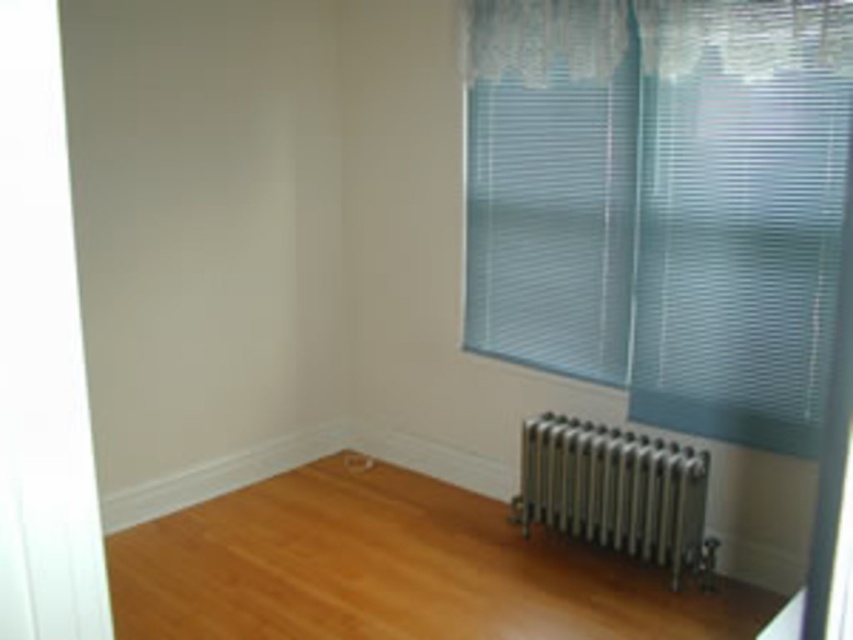
Question: Is translucent plastic blinds at right to the right of silver metallic radiator at lower right from the viewer's perspective?

Choices:
 (A) yes
 (B) no

Answer: (A)

Question: Among these points, which one is nearest to the camera?

Choices:
 (A) (624, 490)
 (B) (297, 577)
 (C) (674, 36)

Answer: (C)

Question: Which object is positioned farthest from the translucent plastic blinds at right?

Choices:
 (A) shiny brown hardwood floor at center
 (B) white sheer curtain at upper center

Answer: (A)

Question: Is shiny brown hardwood floor at center below silver metallic radiator at lower right?

Choices:
 (A) yes
 (B) no

Answer: (A)

Question: Which point is farther to the camera?

Choices:
 (A) (541, 342)
 (B) (374, 490)
 (C) (747, 45)

Answer: (B)

Question: Does shiny brown hardwood floor at center appear over white sheer curtain at upper center?

Choices:
 (A) yes
 (B) no

Answer: (B)